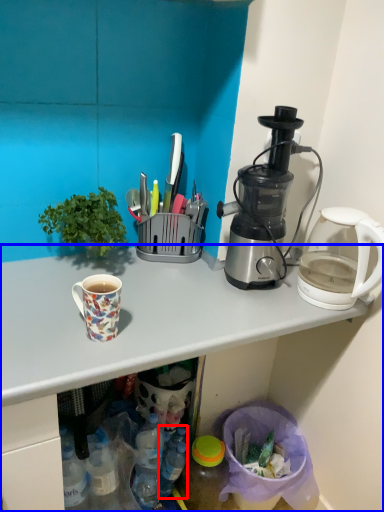
Question: Which point is closer to the camera, bottle (highlighted by a red box) or desk (highlighted by a blue box)?

Choices:
 (A) bottle
 (B) desk

Answer: (B)